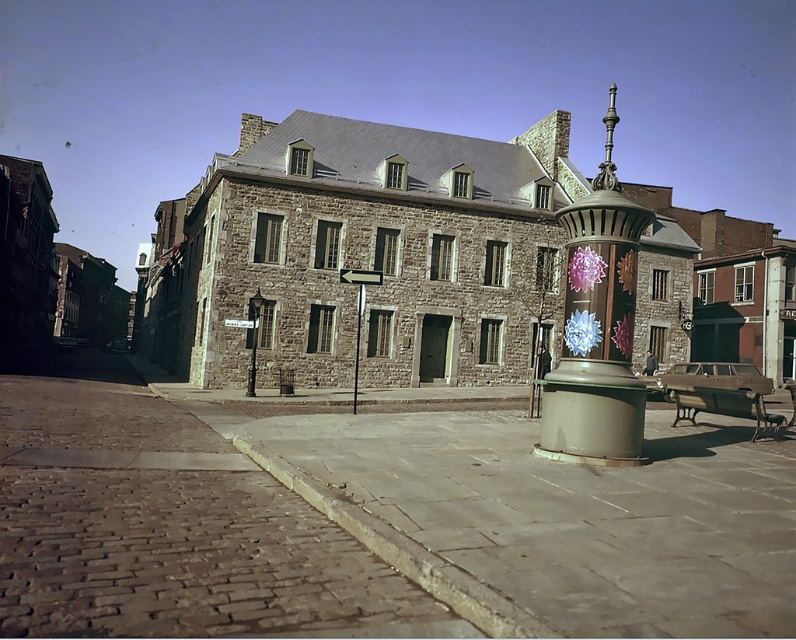
Question: Which point is closer to the camera?

Choices:
 (A) smooth concrete pavement at center
 (B) metallic gold trash can at center

Answer: (A)

Question: Is brown cobblestone pavement at lower left thinner than metallic gold trash can at center?

Choices:
 (A) yes
 (B) no

Answer: (A)

Question: Which point is closer to the camera taking this photo?

Choices:
 (A) (486, 518)
 (B) (603, 358)

Answer: (A)

Question: Which point appears closest to the camera in this image?

Choices:
 (A) coord(162,435)
 (B) coord(562,380)

Answer: (B)

Question: Does smooth concrete pavement at center appear on the right side of brown cobblestone pavement at lower left?

Choices:
 (A) yes
 (B) no

Answer: (A)

Question: Can you confirm if brown cobblestone pavement at lower left is thinner than metallic gold trash can at center?

Choices:
 (A) yes
 (B) no

Answer: (A)